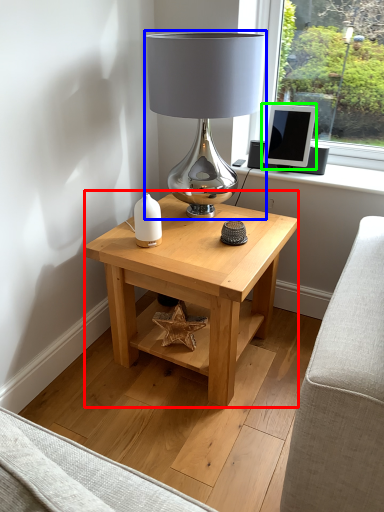
Question: Considering the real-world distances, which object is farthest from table (highlighted by a red box)? lamp (highlighted by a blue box) or computer monitor (highlighted by a green box)?

Choices:
 (A) lamp
 (B) computer monitor

Answer: (B)